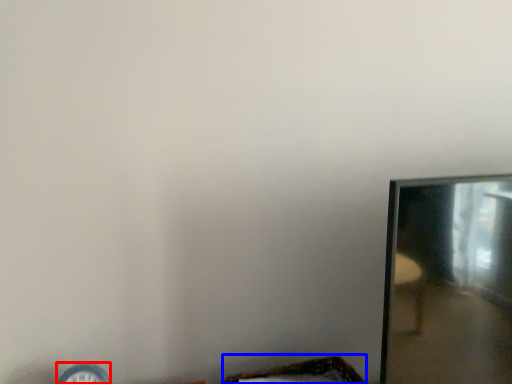
Question: Which of the following is the farthest to the observer, clock (highlighted by a red box) or basket (highlighted by a blue box)?

Choices:
 (A) clock
 (B) basket

Answer: (B)